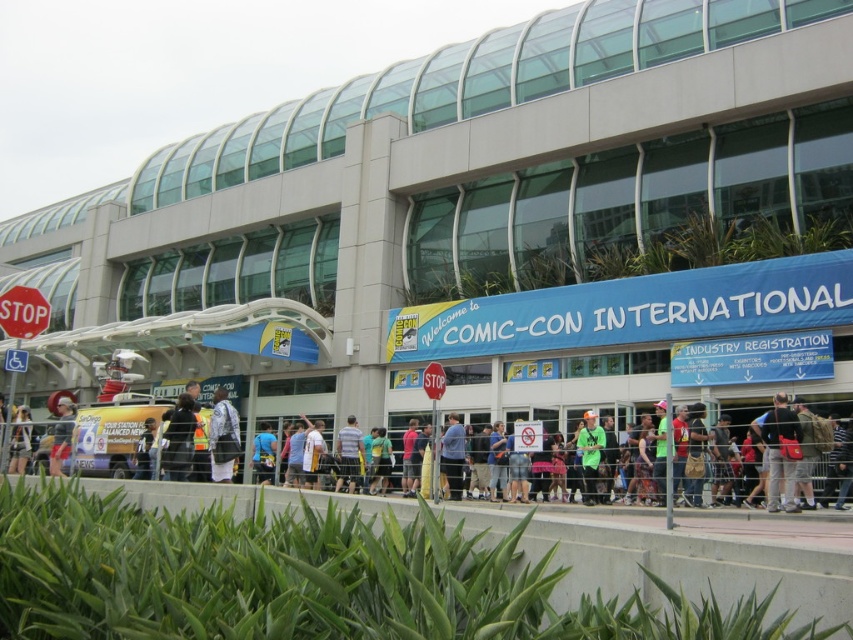
You are an event organizer at Comic Con and need to arrange a photo shoot. You have two items to place in the center of the crowd scene for the backdrop. The dark gray backpack at center and the striped shirt at center are both in the center. Which item should you choose if you want the smaller object to be the focal point?

The dark gray backpack at center is smaller than the striped shirt at center, so you should choose the dark gray backpack at center to be the focal point.

You are standing at the entrance of Comic Con International and see a dark gray backpack at center and a striped shirt at center. Which object is taller?

The dark gray backpack at center is much taller than the striped shirt at center.

You are standing at the entrance of Comic Con International and see a dark gray backpack at center and a striped shirt at center. You want to pick up both items but can only move forward. Which item should you reach first?

The dark gray backpack at center is 11.59 meters away from striped shirt at center, so you should reach the striped shirt at center first since it is closer to you.